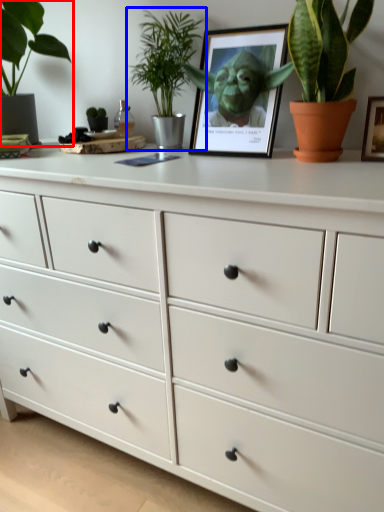
Question: Which point is further to the camera, houseplant (highlighted by a red box) or houseplant (highlighted by a blue box)?

Choices:
 (A) houseplant
 (B) houseplant

Answer: (B)